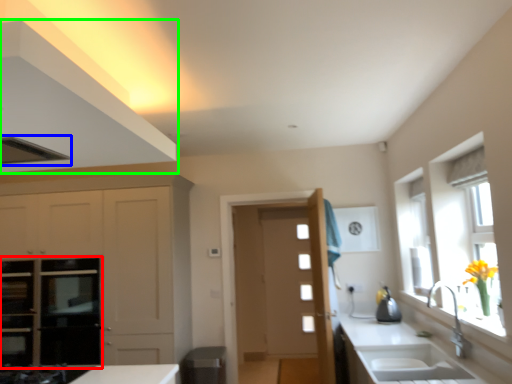
Question: Estimate the real-world distances between objects in this image. Which object is farther from oven (highlighted by a red box), exhaust hood (highlighted by a blue box) or cabinetry (highlighted by a green box)?

Choices:
 (A) exhaust hood
 (B) cabinetry

Answer: (B)